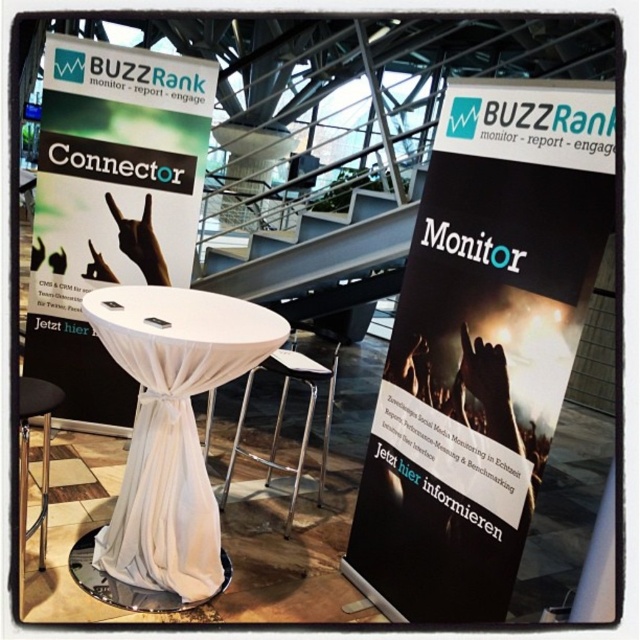
Question: In this image, where is black paper at left located relative to black metal stool at lower left?

Choices:
 (A) above
 (B) below

Answer: (A)

Question: Is black paper poster at center positioned before white cloth-covered table at center?

Choices:
 (A) no
 (B) yes

Answer: (B)

Question: Which of the following is the farthest from the observer?

Choices:
 (A) (29, 380)
 (B) (269, 317)
 (C) (179, 259)
 (D) (289, 353)

Answer: (C)

Question: Which point is farther to the camera?

Choices:
 (A) (118, 520)
 (B) (140, 236)
 (C) (484, 104)

Answer: (B)

Question: Can you confirm if black paper at left is thinner than black metal stool at lower left?

Choices:
 (A) no
 (B) yes

Answer: (A)

Question: Which of the following is the closest to the observer?

Choices:
 (A) (228, 465)
 (B) (189, 468)

Answer: (B)